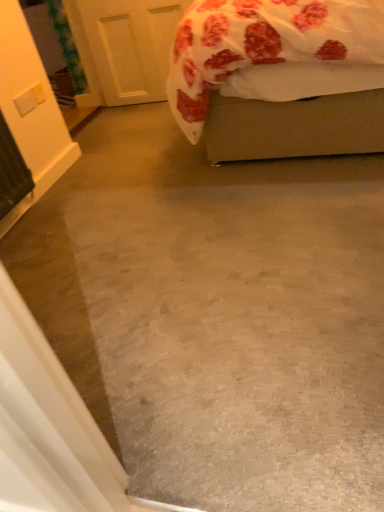
Question: Are white matte door at upper left and fluffy white bed at upper right located far from each other?

Choices:
 (A) no
 (B) yes

Answer: (B)

Question: Does white matte door at upper left come behind fluffy white bed at upper right?

Choices:
 (A) yes
 (B) no

Answer: (A)

Question: Considering the relative positions of white matte door at upper left and fluffy white bed at upper right in the image provided, is white matte door at upper left to the left of fluffy white bed at upper right from the viewer's perspective?

Choices:
 (A) no
 (B) yes

Answer: (B)

Question: Is fluffy white bed at upper right at the back of white matte door at upper left?

Choices:
 (A) yes
 (B) no

Answer: (B)

Question: Is white matte door at upper left placed right next to fluffy white bed at upper right?

Choices:
 (A) yes
 (B) no

Answer: (B)

Question: Is white matte door at upper left positioned before fluffy white bed at upper right?

Choices:
 (A) yes
 (B) no

Answer: (B)

Question: Can you confirm if fluffy white bed at upper right is shorter than white matte door at upper left?

Choices:
 (A) yes
 (B) no

Answer: (B)

Question: Is fluffy white bed at upper right oriented away from white matte door at upper left?

Choices:
 (A) no
 (B) yes

Answer: (A)

Question: Can you confirm if fluffy white bed at upper right is smaller than white matte door at upper left?

Choices:
 (A) yes
 (B) no

Answer: (B)

Question: Is fluffy white bed at upper right bigger than white matte door at upper left?

Choices:
 (A) no
 (B) yes

Answer: (B)

Question: From the image's perspective, is fluffy white bed at upper right on white matte door at upper left?

Choices:
 (A) yes
 (B) no

Answer: (B)

Question: Are fluffy white bed at upper right and white matte door at upper left far apart?

Choices:
 (A) yes
 (B) no

Answer: (A)

Question: Is point (150, 24) closer or farther from the camera than point (198, 65)?

Choices:
 (A) closer
 (B) farther

Answer: (B)